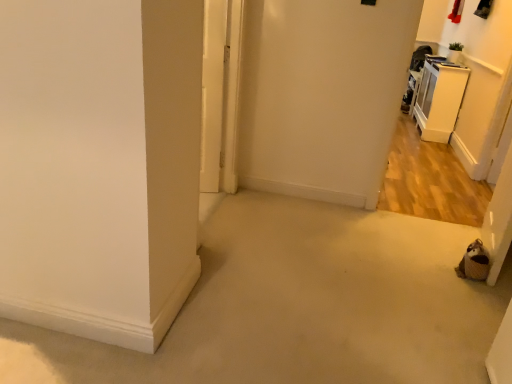
What do you see at coordinates (439, 98) in the screenshot? Image resolution: width=512 pixels, height=384 pixels. I see `white glossy cabinet at upper right` at bounding box center [439, 98].

What is the approximate width of white glossy cabinet at upper right?

white glossy cabinet at upper right is 33.69 centimeters in width.

Where is `white glossy cabinet at upper right`? This screenshot has height=384, width=512. white glossy cabinet at upper right is located at coordinates (439, 98).

What are the coordinates of `white glossy cabinet at upper right` in the screenshot? It's located at (439, 98).